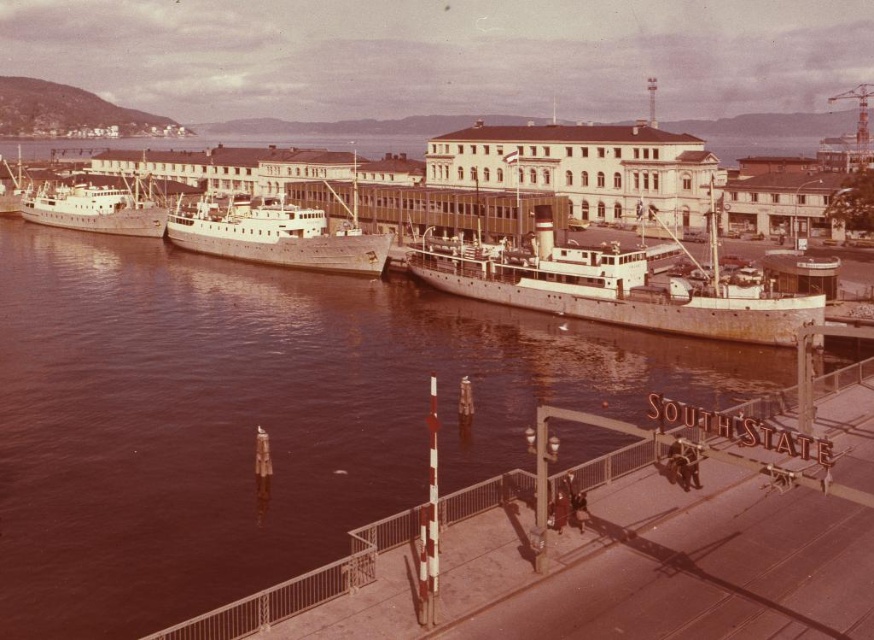
Who is more distant from viewer, (283, 339) or (248, 211)?

Point (248, 211)

Can you confirm if brown water at center is shorter than metallic gray ship at center?

No, brown water at center is not shorter than metallic gray ship at center.

This screenshot has height=640, width=874. What are the coordinates of `brown water at center` in the screenshot? It's located at (261, 417).

Who is positioned more to the left, white matte ship at center or white matte ship at left?

white matte ship at left is more to the left.

Who is positioned more to the right, white matte ship at center or white matte ship at left?

white matte ship at center

Locate an element on the screen. white matte ship at center is located at coordinates (616, 285).

Describe the element at coordinates (616, 285) in the screenshot. I see `white matte ship at center` at that location.

Between white matte ship at center and metallic gray ship at center, which one has less height?

Standing shorter between the two is metallic gray ship at center.

Does point (574, 244) come behind point (283, 237)?

No, it is in front of (283, 237).

At what (x,y) coordinates should I click in order to perform the action: click on white matte ship at center. Please return your answer as a coordinate pair (x, y). Looking at the image, I should click on (616, 285).